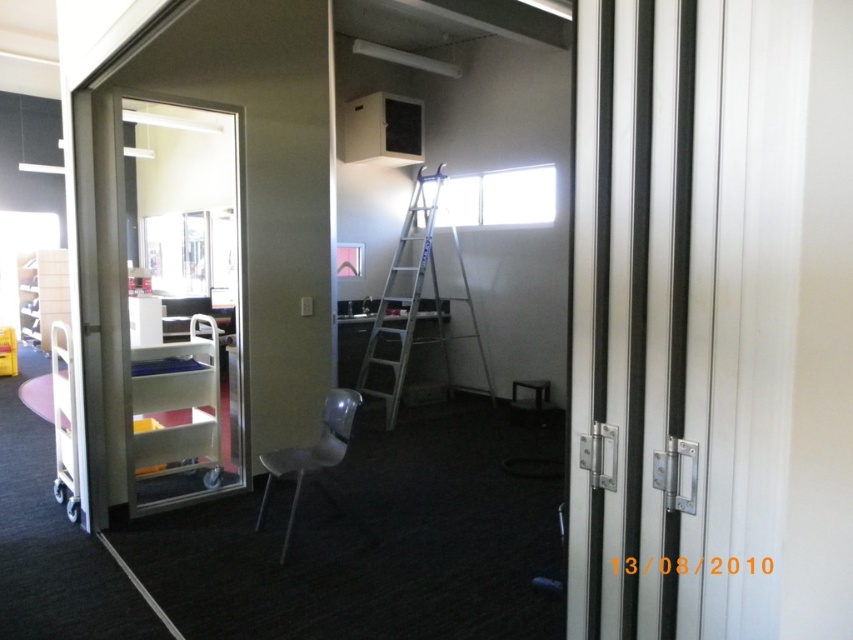
Question: Does silver metallic ladder at center lie in front of matte gray chair at center?

Choices:
 (A) yes
 (B) no

Answer: (B)

Question: Can you confirm if silver metallic ladder at center is positioned below matte gray chair at center?

Choices:
 (A) no
 (B) yes

Answer: (A)

Question: Which object is the farthest from the matte gray chair at center?

Choices:
 (A) silver metallic ladder at center
 (B) metallic silver cart at left

Answer: (A)

Question: Which object is positioned farthest from the matte gray chair at center?

Choices:
 (A) metallic silver cart at left
 (B) silver metallic ladder at center

Answer: (B)

Question: Which of the following is the closest to the observer?

Choices:
 (A) (283, 474)
 (B) (390, 307)

Answer: (A)

Question: Does metallic silver cart at left come in front of matte gray chair at center?

Choices:
 (A) no
 (B) yes

Answer: (A)